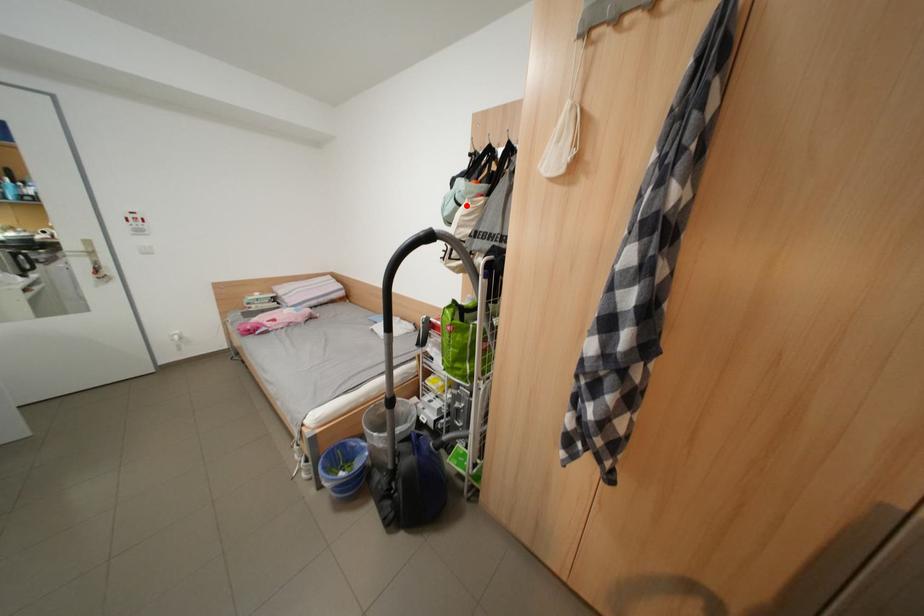
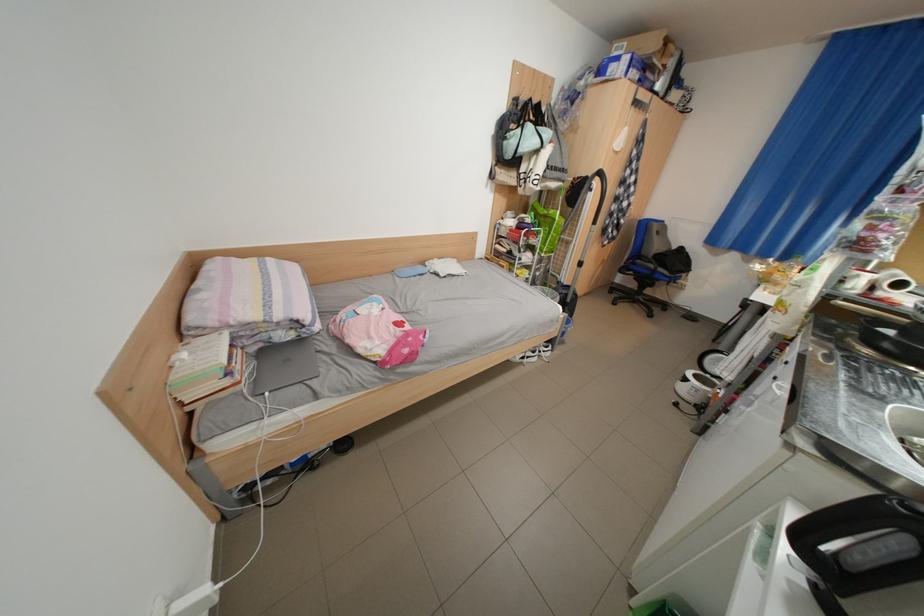
Find the pixel in the second image that matches the highlighted location in the first image.

(552, 147)